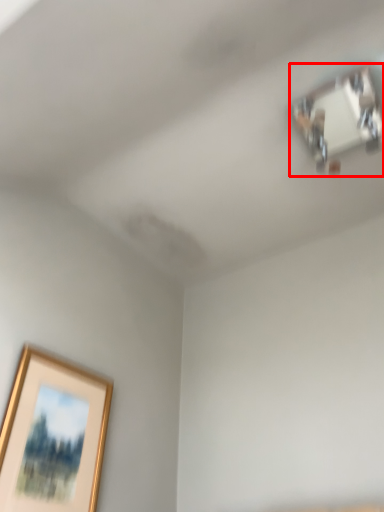
Question: Where is wide (annotated by the red box) located in relation to picture frame in the image?

Choices:
 (A) left
 (B) right

Answer: (B)